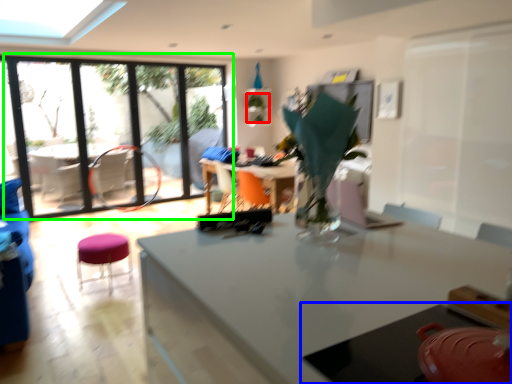
Question: Estimate the real-world distances between objects in this image. Which object is farther from plant (highlighted by a red box), table (highlighted by a blue box) or window (highlighted by a green box)?

Choices:
 (A) table
 (B) window

Answer: (A)